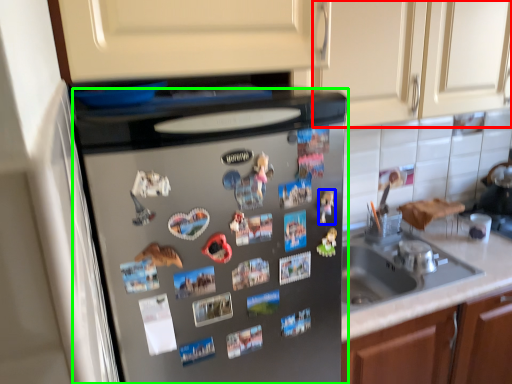
Question: Estimate the real-world distances between objects in this image. Which object is closer to cabinetry (highlighted by a red box), toy (highlighted by a blue box) or home appliance (highlighted by a green box)?

Choices:
 (A) toy
 (B) home appliance

Answer: (B)